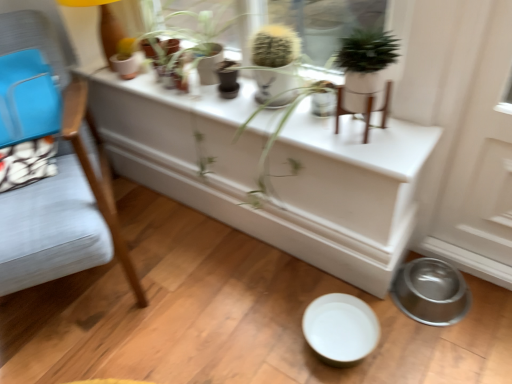
Locate an element on the screen. This screenshot has width=512, height=384. vacant position to the left of fuzzy green cactus at upper center, the second houseplant from the front is located at coordinates (229, 94).